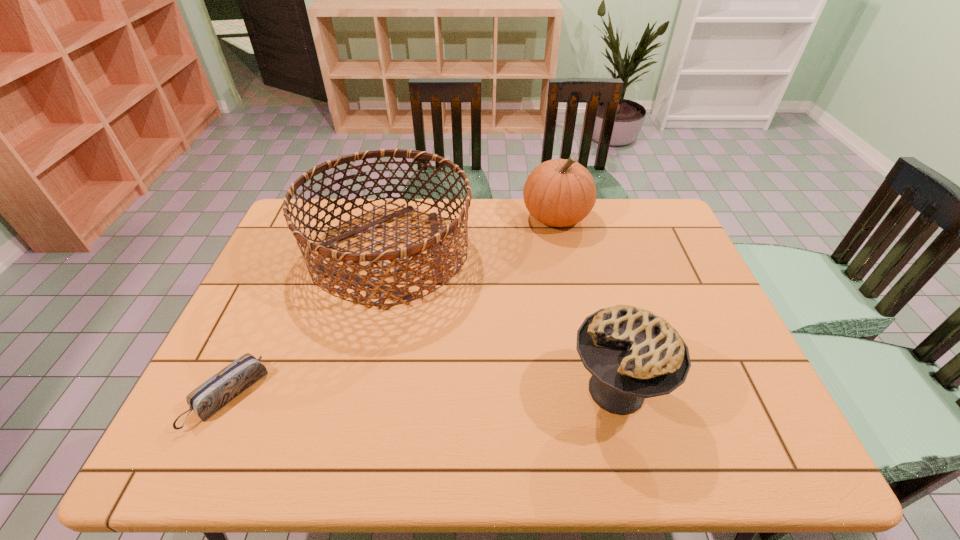
The image size is (960, 540). Find the location of `pumpkin at the far edge`. pumpkin at the far edge is located at coordinates (560, 192).

Image resolution: width=960 pixels, height=540 pixels. Identify the location of basket that is at the far edge. (396, 293).

Find the location of a particular element. pie at the near edge is located at coordinates (632, 354).

I want to click on pencil box situated at the near edge, so click(217, 391).

Identify the location of basket that is positioned at the left edge. (396, 293).

At what (x,y) coordinates should I click in order to perform the action: click on pencil box at the left edge. Please return your answer as a coordinate pair (x, y). This screenshot has height=540, width=960. Looking at the image, I should click on (217, 391).

Find the location of a particular element. This screenshot has width=960, height=540. object positioned at the far left corner is located at coordinates (396, 293).

Identify the location of object that is at the near left corner. pos(217,391).

The width and height of the screenshot is (960, 540). In order to click on free space at the far edge in this screenshot , I will do `click(578, 240)`.

Find the location of a particular element. This screenshot has height=540, width=960. free space at the near edge is located at coordinates (492, 435).